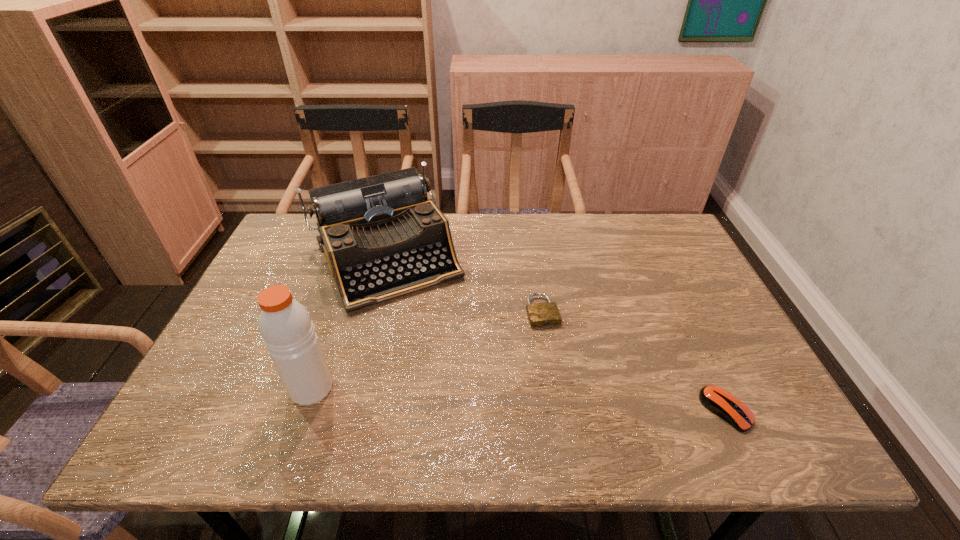
Image resolution: width=960 pixels, height=540 pixels. What are the coordinates of `object located in the near right corner section of the desktop` in the screenshot? It's located at (720, 402).

I want to click on free space at the far edge of the desktop, so click(x=475, y=252).

Identify the location of vacant point at the near edge. This screenshot has width=960, height=540. (628, 396).

Image resolution: width=960 pixels, height=540 pixels. I want to click on vacant space at the left edge of the desktop, so click(x=243, y=347).

This screenshot has height=540, width=960. What are the coordinates of `vacant space at the far left corner of the desktop` in the screenshot? It's located at (301, 233).

Identify the location of unoccupied position between the shortest object and the tallest object. (427, 350).

Image resolution: width=960 pixels, height=540 pixels. I want to click on vacant point located between the typewriter and the shortest object, so click(x=464, y=285).

Locate an element on the screen. unoccupied position between the tallest object and the rightmost object is located at coordinates (518, 399).

Image resolution: width=960 pixels, height=540 pixels. I want to click on vacant area that lies between the computer mouse and the third shortest object, so click(x=556, y=334).

The image size is (960, 540). I want to click on free space that is in between the shaker and the second object from right to left, so 427,350.